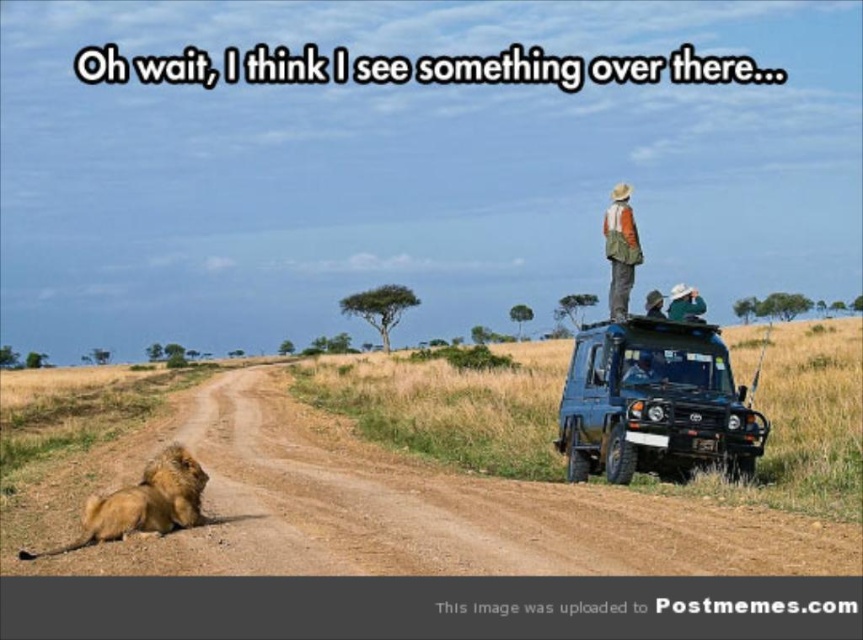
Is blue matte suv at right further to the viewer compared to orange fabric hat at upper right?

That is False.

Is point (694, 340) positioned behind point (627, 253)?

No, (694, 340) is closer to viewer.

Which is behind, point (695, 364) or point (630, 228)?

The point (630, 228) is behind.

The height and width of the screenshot is (640, 863). I want to click on blue matte suv at right, so click(654, 404).

Which of these two, orange fabric hat at upper right or matte black camera at upper center, stands shorter?

matte black camera at upper center is shorter.

Is orange fabric hat at upper right closer to the viewer compared to matte black camera at upper center?

No.

Find the location of a particular element. orange fabric hat at upper right is located at coordinates (620, 250).

Does golden fur lion at lower left appear over green fabric hat at upper center?

Actually, golden fur lion at lower left is below green fabric hat at upper center.

This screenshot has width=863, height=640. What do you see at coordinates (142, 502) in the screenshot? I see `golden fur lion at lower left` at bounding box center [142, 502].

Where is `golden fur lion at lower left`? This screenshot has height=640, width=863. golden fur lion at lower left is located at coordinates (142, 502).